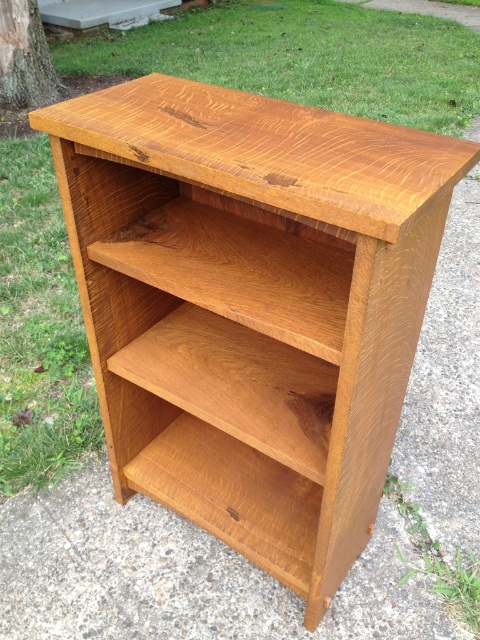
You are organizing books on the wooden bookshelf and notice two items labeled as light brown wood at center and light brown wood drawer at center. Which one can you place more books on?

The light brown wood at center is larger in size than the light brown wood drawer at center, so you can place more books on the light brown wood at center.

You are a gardener who needs to place a 40 cm wide potted plant between the light brown wood at center and the light brown wood drawer at center. Can you fit it there?

The distance between the light brown wood at center and the light brown wood drawer at center is 43.49 centimeters, which is wider than the 40 cm potted plant. Therefore, the potted plant can fit between them.

You are standing in front of a wooden bookshelf in an outdoor setting. The bookshelf has three shelves with varying depths. Where is the light brown wood at center located in terms of its coordinates?

The light brown wood at center is located at coordinates point (238,384).